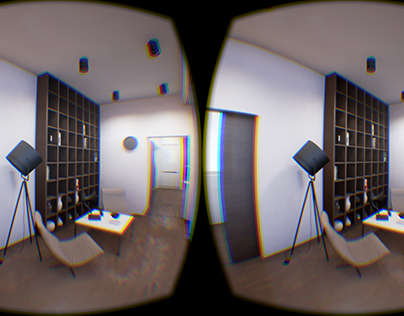
The image size is (404, 316). Find the location of `walls`. walls is located at coordinates (20, 109), (274, 97).